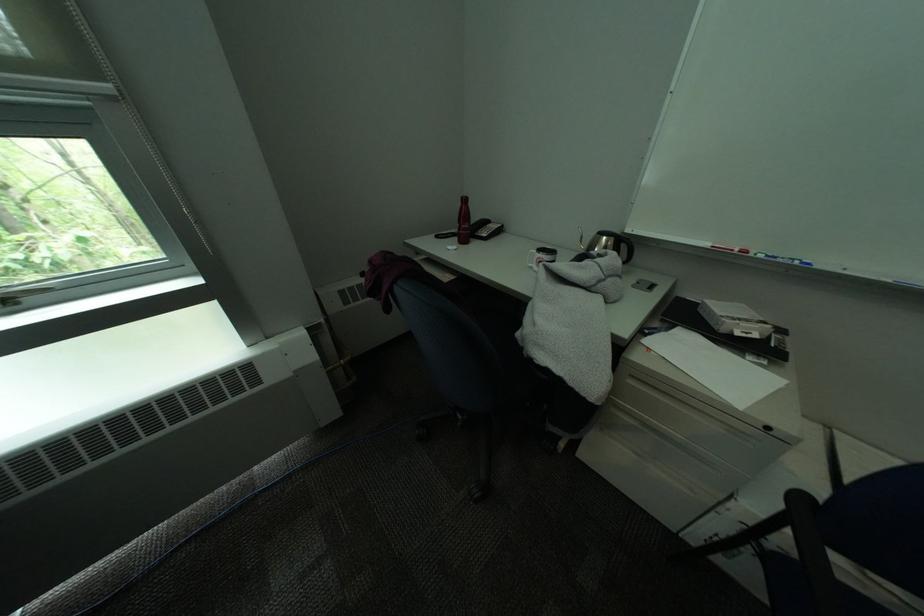
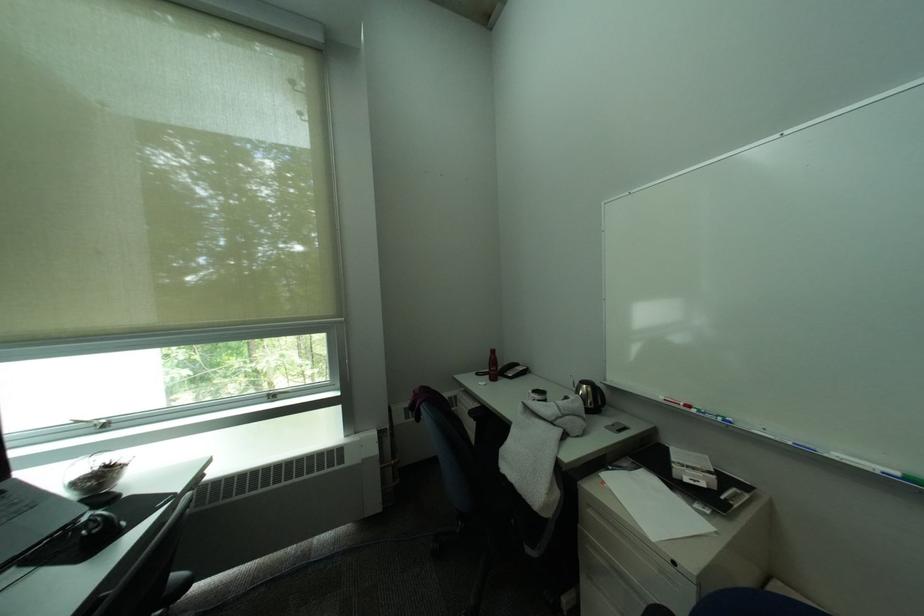
In the second image, find the point that corresponds to (x=448, y=238) in the first image.

(488, 376)